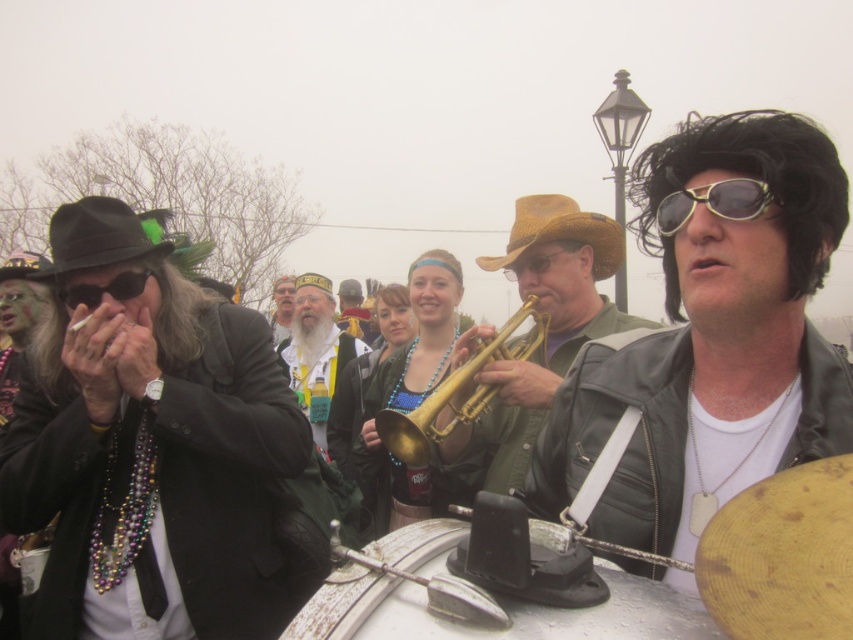
You are a photographer trying to capture the shiny black wig at upper right in the center of your camera frame. Based on its current position at point coordinates, is the wig positioned to the left or right of the frame?

The shiny black wig at upper right is located at point coordinates, so it is positioned to the right of the frame.

You are a photographer trying to capture a photo of the two hats in the scene. You need to arrange them so that the black felt cowboy hat at left is to the right of the beige fabric hat at center. Is this already the case in the current arrangement?

Yes, the black felt cowboy hat at left is already positioned on the right side of the beige fabric hat at center, so no adjustment is needed.